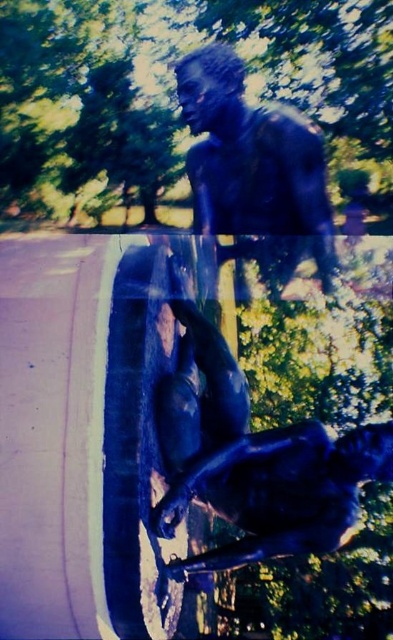
Question: Among these objects, which one is nearest to the camera?

Choices:
 (A) bronze statue at upper center
 (B) shiny bronze statue at center

Answer: (B)

Question: Is shiny bronze statue at center to the right of bronze statue at upper center from the viewer's perspective?

Choices:
 (A) yes
 (B) no

Answer: (B)

Question: Is shiny bronze statue at center thinner than bronze statue at upper center?

Choices:
 (A) yes
 (B) no

Answer: (B)

Question: Does shiny bronze statue at center have a larger size compared to bronze statue at upper center?

Choices:
 (A) no
 (B) yes

Answer: (B)

Question: Which object appears closest to the camera in this image?

Choices:
 (A) shiny bronze statue at center
 (B) bronze statue at upper center

Answer: (A)

Question: Which point appears closest to the camera in this image?

Choices:
 (A) (249, 468)
 (B) (211, 116)

Answer: (B)